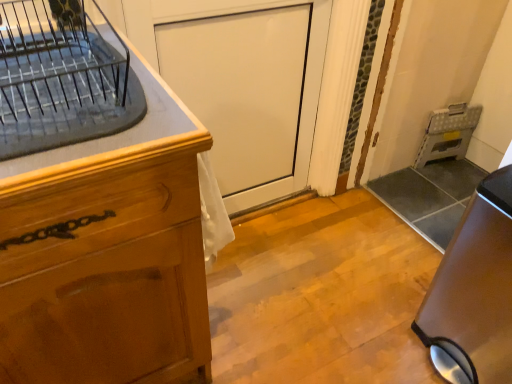
Find the location of `blank area to the left of satin brown trash can at lower right`. blank area to the left of satin brown trash can at lower right is located at coordinates (367, 331).